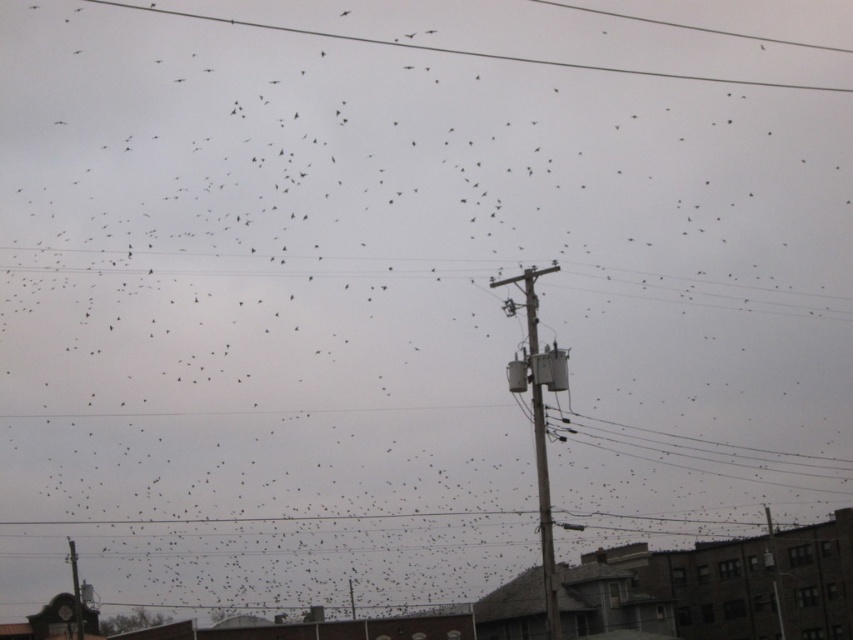
Question: Does wooden utility pole at center appear on the right side of smooth wire at upper center?

Choices:
 (A) yes
 (B) no

Answer: (A)

Question: Is wooden utility pole at center closer to camera compared to smooth wire at upper center?

Choices:
 (A) yes
 (B) no

Answer: (A)

Question: Which point is closer to the camera?

Choices:
 (A) wooden utility pole at center
 (B) smooth wire at upper center

Answer: (A)

Question: Which object is closer to the camera taking this photo?

Choices:
 (A) smooth wire at upper center
 (B) wooden utility pole at center

Answer: (B)

Question: Among these objects, which one is nearest to the camera?

Choices:
 (A) smooth wire at upper center
 (B) wooden utility pole at center

Answer: (B)

Question: Is wooden utility pole at center below smooth wire at upper center?

Choices:
 (A) yes
 (B) no

Answer: (A)